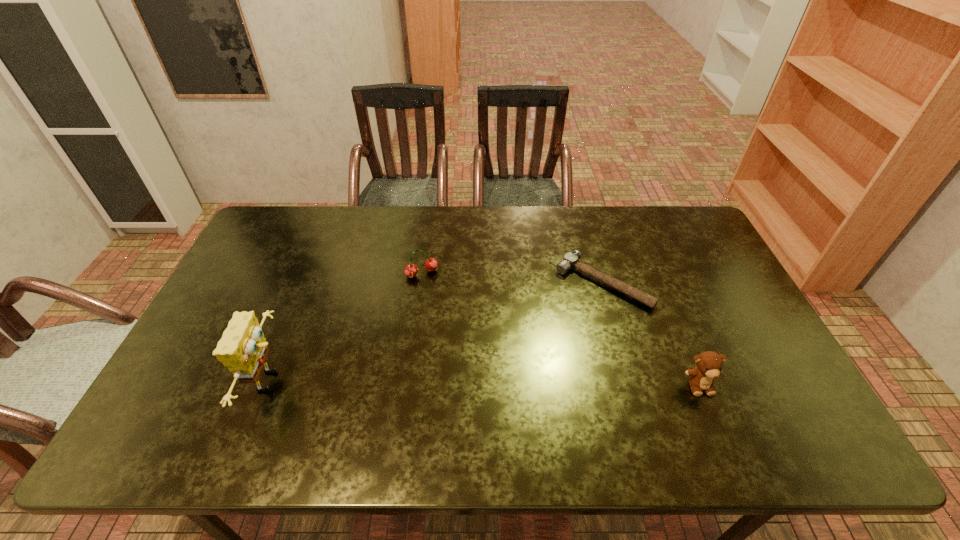
This screenshot has width=960, height=540. Identify the location of free area in between the sponge and the teddy bear. (485, 383).

Locate an element on the screen. The image size is (960, 540). blank region between the hammer and the teddy bear is located at coordinates (651, 334).

Where is `free space between the tallest object and the shortest object`? The height and width of the screenshot is (540, 960). free space between the tallest object and the shortest object is located at coordinates (437, 332).

Identify the location of vacant space in between the teddy bear and the leftmost object. (485, 383).

At what (x,y) coordinates should I click in order to perform the action: click on vacant area that lies between the teddy bear and the third object from right to left. Please return your answer as a coordinate pair (x, y). This screenshot has width=960, height=540. Looking at the image, I should click on (561, 329).

The width and height of the screenshot is (960, 540). Find the location of `vacant space in between the second object from left to right and the hammer`. vacant space in between the second object from left to right and the hammer is located at coordinates (513, 278).

Locate an element on the screen. free space between the third object from right to left and the leftmost object is located at coordinates (347, 327).

Find the location of `free space between the teddy bear and the sponge`. free space between the teddy bear and the sponge is located at coordinates (485, 383).

Where is `free space between the tallest object and the hammer`? The width and height of the screenshot is (960, 540). free space between the tallest object and the hammer is located at coordinates (437, 332).

At what (x,y) coordinates should I click in order to perform the action: click on object that is the second closest to the teddy bear. Please return your answer as a coordinate pair (x, y). Looking at the image, I should click on (411, 270).